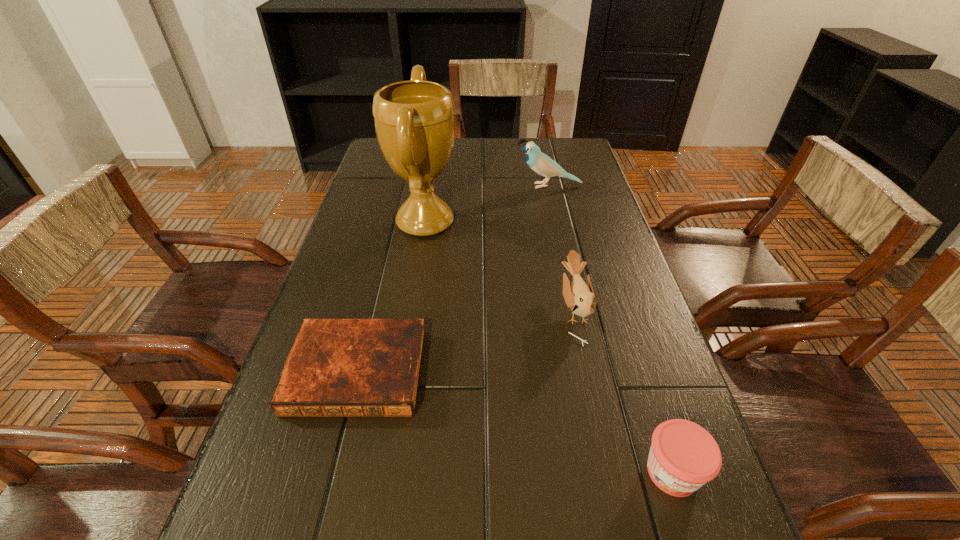
The image size is (960, 540). I want to click on vacant space positioned 0.230m at the face of the taller bird, so click(443, 186).

Where is `blank area located 0.290m at the face of the taller bird`? The image size is (960, 540). blank area located 0.290m at the face of the taller bird is located at coordinates (423, 186).

Where is `vacant space located at the beak of the nearer bird`? The height and width of the screenshot is (540, 960). vacant space located at the beak of the nearer bird is located at coordinates (435, 309).

I want to click on free space located at the beak of the nearer bird, so click(511, 309).

I want to click on vacant space located at the beak of the nearer bird, so click(484, 309).

The width and height of the screenshot is (960, 540). In order to click on free space located on the spine side of the Bible in this screenshot , I will do `click(338, 450)`.

You are a GUI agent. You are given a task and a screenshot of the screen. Output one action in this format:
    pyautogui.click(x=<x>, y=<y>)
    Task: Click on the award that is at the left edge
    
    Given the screenshot: What is the action you would take?
    pyautogui.click(x=414, y=120)

You are a GUI agent. You are given a task and a screenshot of the screen. Output one action in this format:
    pyautogui.click(x=<x>, y=<y>)
    Task: Click on the Bible at the left edge
    The image size is (960, 540).
    Given the screenshot: What is the action you would take?
    pyautogui.click(x=336, y=367)

Where is `jam at the right edge`? The image size is (960, 540). jam at the right edge is located at coordinates (683, 456).

Identify the location of vacant space at the far edge. The width and height of the screenshot is (960, 540). (486, 154).